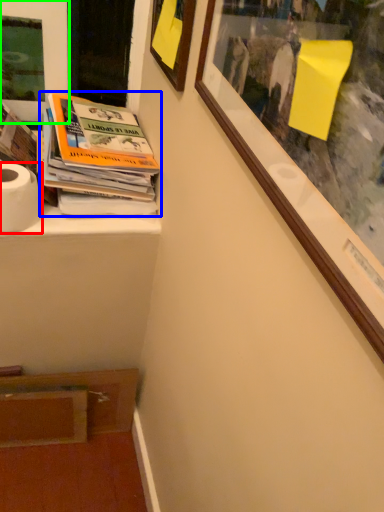
Question: Considering the real-world distances, which object is farthest from toilet paper (highlighted by a red box)? book (highlighted by a blue box) or picture frame (highlighted by a green box)?

Choices:
 (A) book
 (B) picture frame

Answer: (B)